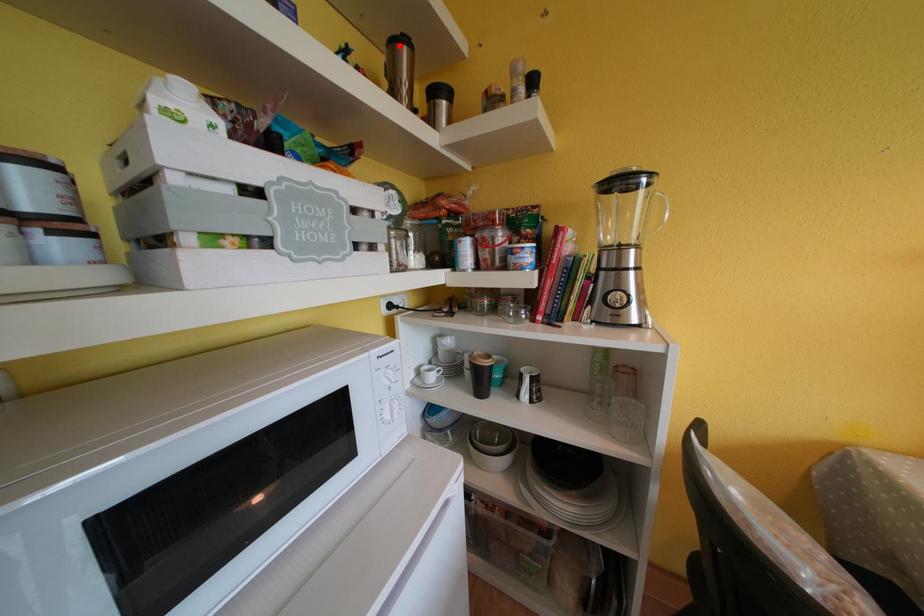
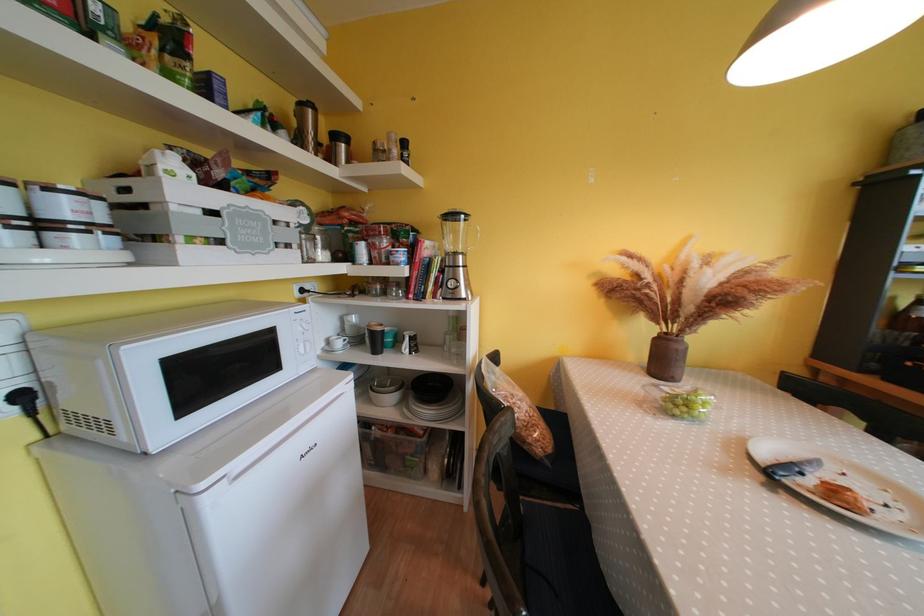
The point at the highlighted location is marked in the first image. Where is the corresponding point in the second image?

(308, 108)